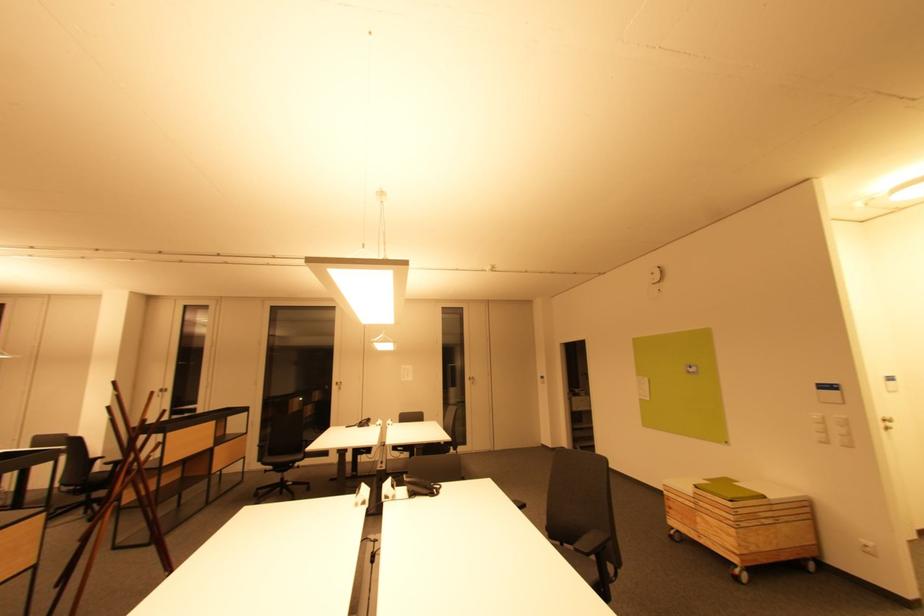
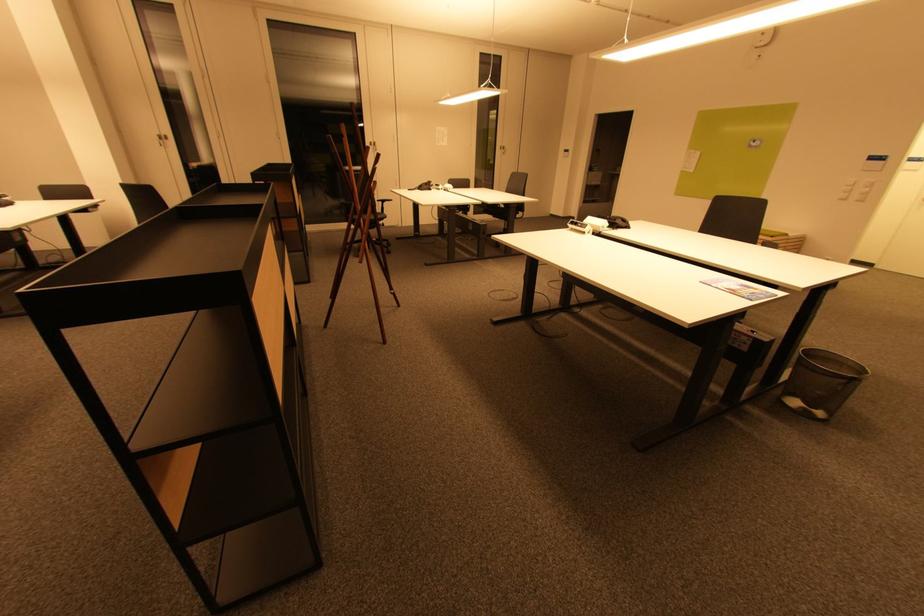
Where in the second image is the point corresponding to point (845, 428) from the first image?

(870, 188)